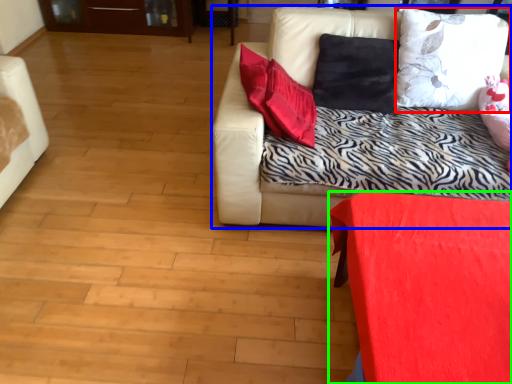
Question: Estimate the real-world distances between objects in this image. Which object is closer to pillow (highlighted by a red box), studio couch (highlighted by a blue box) or furniture (highlighted by a green box)?

Choices:
 (A) studio couch
 (B) furniture

Answer: (A)